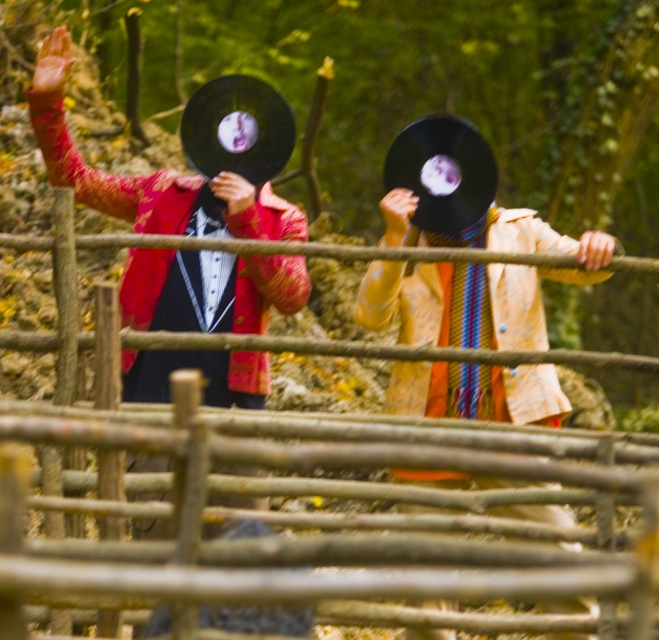
You are a GUI agent. You are given a task and a screenshot of the screen. Output one action in this format:
    pyautogui.click(x=<x>, y=<y>)
    Task: Click on the wooden at center
    Image resolution: width=659 pixels, height=640 pixels.
    Given the screenshot: What is the action you would take?
    pyautogui.click(x=312, y=493)